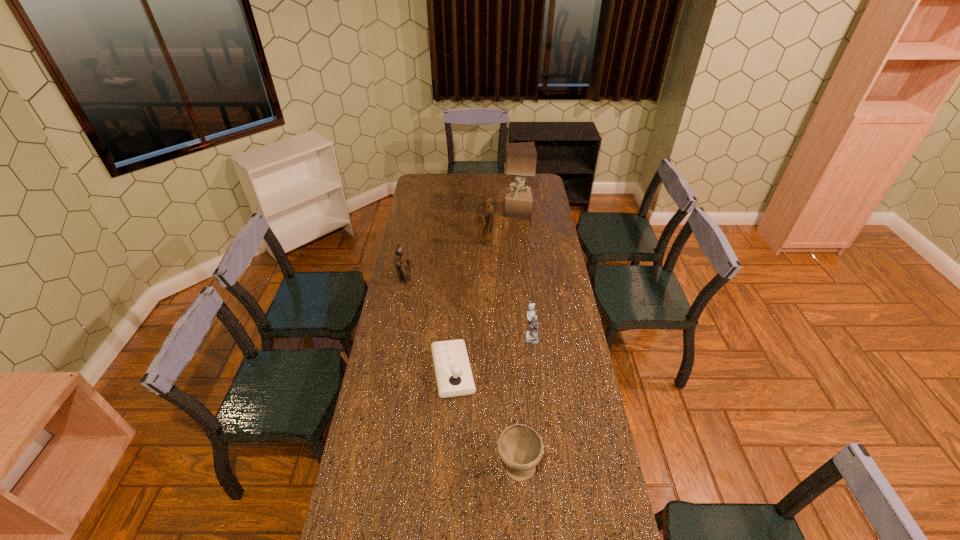
Identify the location of the shortest object. The height and width of the screenshot is (540, 960). (454, 377).

You are a GUI agent. You are given a task and a screenshot of the screen. Output one action in this format:
    pyautogui.click(x=<x>, y=<y>)
    Task: Click on the fifth farthest object
    This screenshot has width=960, height=540.
    Given the screenshot: What is the action you would take?
    (454, 377)

At what (x,y) coordinates should I click in order to perform the action: click on vacant space located 0.130m on the front-facing side of the tallest object. Please return your answer as a coordinate pair (x, y). Image resolution: width=960 pixels, height=540 pixels. Looking at the image, I should click on (480, 212).

Identify the location of free space located 0.140m on the front-facing side of the tallest object. This screenshot has width=960, height=540. 479,212.

You are a GUI agent. You are given a task and a screenshot of the screen. Output one action in this format:
    pyautogui.click(x=<x>, y=<y>)
    Task: Click on the blank space located 0.120m on the front-facing side of the tallest object
    The height and width of the screenshot is (540, 960).
    Given the screenshot: What is the action you would take?
    pyautogui.click(x=482, y=212)

Identify the location of vacant space situated 0.260m on the front-facing side of the farthest figurine. Image resolution: width=960 pixels, height=540 pixels. (486, 279).

The width and height of the screenshot is (960, 540). I want to click on vacant space located 0.300m on the front-facing side of the leftmost figurine, so click(x=477, y=281).

This screenshot has height=540, width=960. What are the coordinates of `free space located 0.400m on the front-facing side of the nearest figurine` in the screenshot? It's located at (426, 338).

Identify the location of free spot located on the front-facing side of the nearest figurine. (487, 338).

The width and height of the screenshot is (960, 540). I want to click on vacant area situated on the front-facing side of the nearest figurine, so click(433, 338).